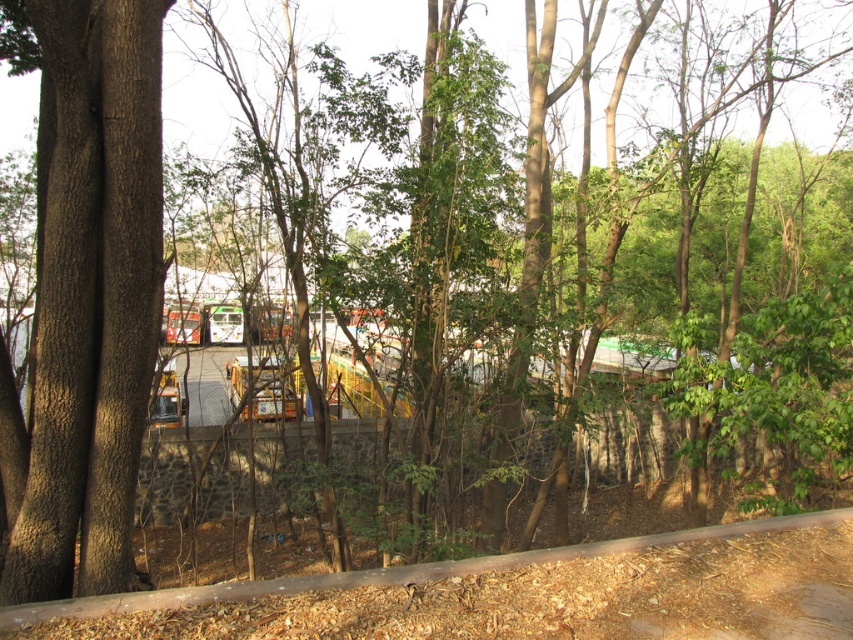
You are standing in the park and want to take a photo of the brown rough tree trunk at left. If your camera can focus on objects up to 5 meters away, will you be able to capture the tree trunk clearly?

The brown rough tree trunk at left is 4.23 meters away from the camera, which is within the camera focus range of up to 5 meters. Therefore, the camera can capture the tree trunk clearly.

You are standing in the park and want to walk from the point at coordinates point (84,264) to the parking lot. There is another point at coordinates point (732,568) blocking your path. Can you walk around it?

Point point (84,264) is in front of point point (732,568), so you can walk around the point at point (732,568) to reach the parking lot.